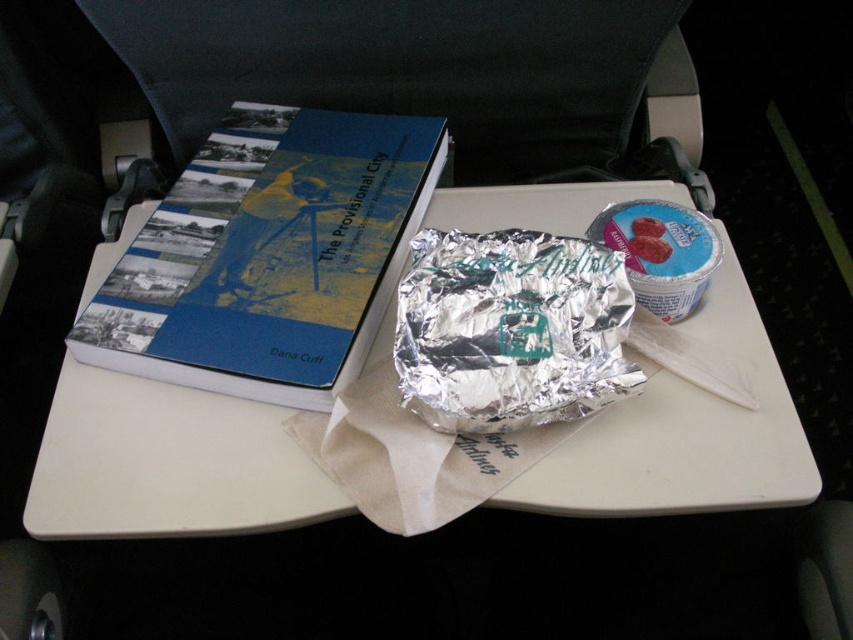
I want to click on blue matte hardcover book at upper left, so click(268, 256).

Can you confirm if blue matte hardcover book at upper left is thinner than silver foil wrap at center?

In fact, blue matte hardcover book at upper left might be wider than silver foil wrap at center.

In order to click on blue matte hardcover book at upper left in this screenshot , I will do `click(268, 256)`.

In the scene shown: Can you confirm if white plastic tray at center is taller than silver foil wrap at center?

Indeed, white plastic tray at center has a greater height compared to silver foil wrap at center.

Between point (279, 513) and point (440, 401), which one is positioned behind?

The point (279, 513) is more distant.

Where is `white plastic tray at center`? The height and width of the screenshot is (640, 853). white plastic tray at center is located at coordinates (166, 464).

Where is `white plastic tray at center`? This screenshot has height=640, width=853. white plastic tray at center is located at coordinates (166, 464).

You are a GUI agent. You are given a task and a screenshot of the screen. Output one action in this format:
    pyautogui.click(x=<x>, y=<y>)
    Task: Click on the white plastic tray at center
    This screenshot has width=853, height=640.
    Given the screenshot: What is the action you would take?
    pyautogui.click(x=166, y=464)